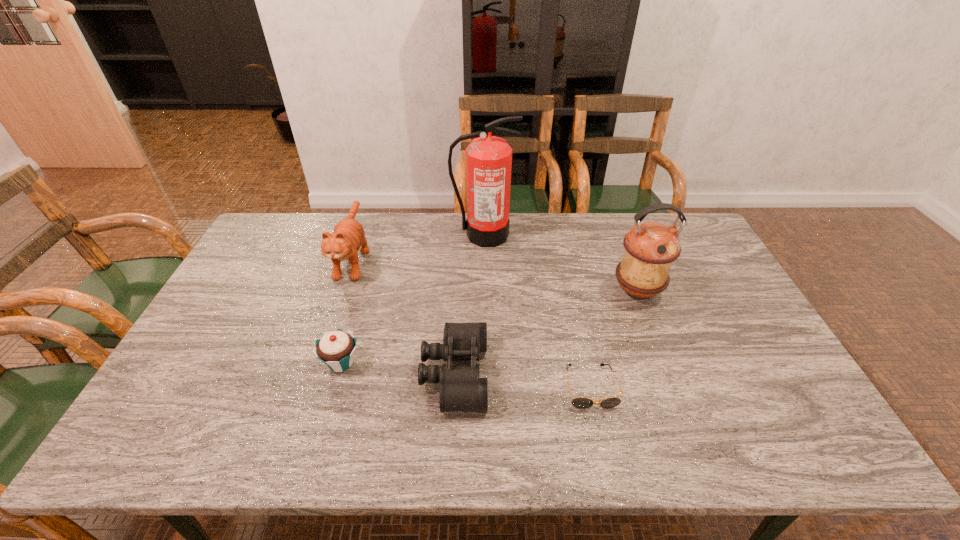
Locate an element on the screen. The image size is (960, 540). fire extinguisher is located at coordinates (488, 158).

Find the location of a particular element. the second tallest object is located at coordinates (650, 248).

Find the location of a particular element. the rightmost object is located at coordinates (650, 248).

In order to click on cat in this screenshot , I will do `click(348, 236)`.

You are a GUI agent. You are given a task and a screenshot of the screen. Output one action in this format:
    pyautogui.click(x=<x>, y=<y>)
    Task: Click on the cupcake
    This screenshot has height=540, width=960.
    Given the screenshot: What is the action you would take?
    pyautogui.click(x=336, y=348)

Locate an element on the screen. This screenshot has height=540, width=960. binoculars is located at coordinates (461, 389).

Image resolution: width=960 pixels, height=540 pixels. In order to click on sunglasses in this screenshot , I will do `click(579, 402)`.

At what (x,y) coordinates should I click in order to perform the action: click on the shortest object. Please return your answer as a coordinate pair (x, y). Looking at the image, I should click on (579, 402).

Identify the location of blank space located 0.170m on the front side of the fire extinguisher. (484, 281).

This screenshot has width=960, height=540. In order to click on free region located on the left of the fifth shortest object in this screenshot , I will do `click(498, 291)`.